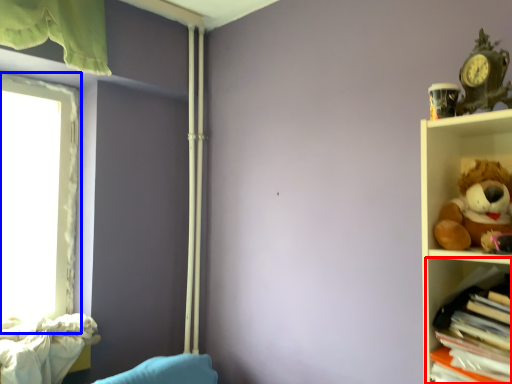
Question: Which of the following is the farthest to the observer, shelf (highlighted by a red box) or window (highlighted by a blue box)?

Choices:
 (A) shelf
 (B) window

Answer: (B)